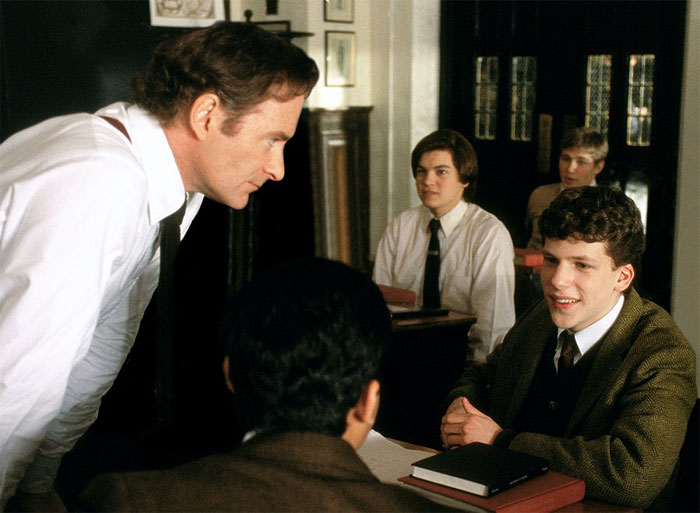
Identify the location of wood paneling on half of wall under picture. (336, 164).